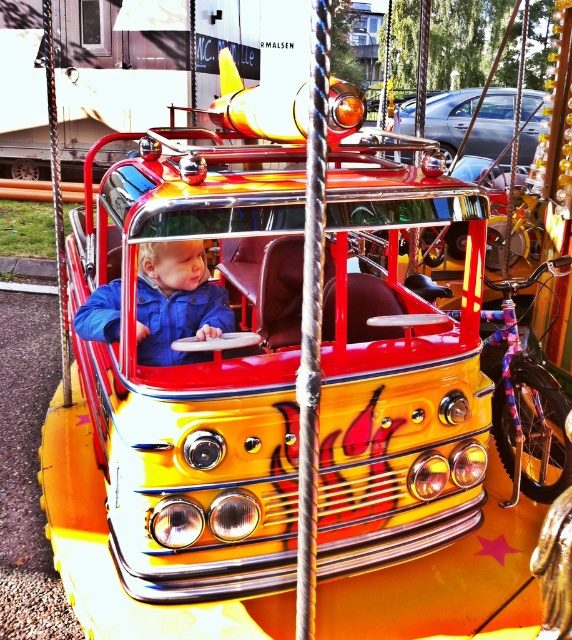
Which is in front, point (89, 316) or point (507, 116)?

Point (89, 316) is more forward.

Does blue fleece jacket at center have a greater height compared to metallic silver car at upper center?

No, blue fleece jacket at center is not taller than metallic silver car at upper center.

Between point (202, 246) and point (535, 104), which one is positioned in front?

Point (202, 246)

The image size is (572, 640). Identify the location of blue fleece jacket at center. (176, 301).